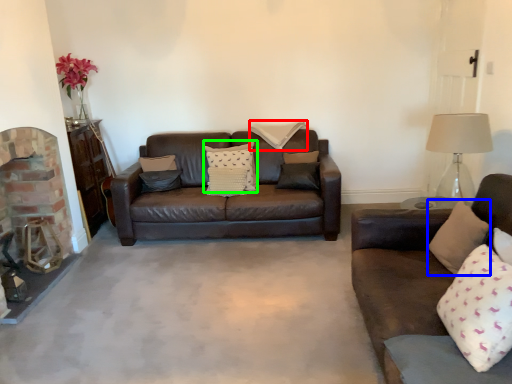
Question: Considering the real-world distances, which object is farthest from pillow (highlighted by a red box)? pillow (highlighted by a blue box) or pillow (highlighted by a green box)?

Choices:
 (A) pillow
 (B) pillow

Answer: (A)